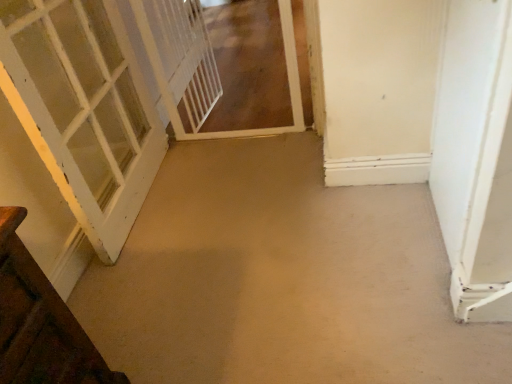
Question: Is beige carpet at center inside white painted wood door at left, which is the third door in right-to-left order?

Choices:
 (A) no
 (B) yes

Answer: (A)

Question: Is white painted wood door at left, which is the third door in right-to-left order, behind beige carpet at center?

Choices:
 (A) no
 (B) yes

Answer: (B)

Question: Is there a large distance between white painted wood door at left, which is the third door in right-to-left order, and beige carpet at center?

Choices:
 (A) yes
 (B) no

Answer: (B)

Question: Does white painted wood door at left, marked as the first door in a left-to-right arrangement, have a smaller size compared to beige carpet at center?

Choices:
 (A) yes
 (B) no

Answer: (B)

Question: Does white painted wood door at left, marked as the first door in a left-to-right arrangement, come in front of beige carpet at center?

Choices:
 (A) no
 (B) yes

Answer: (A)

Question: From the image's perspective, is white mesh screen door at center, which ranks as the 1th screen door in left-to-right order, located above or below beige carpet at center?

Choices:
 (A) above
 (B) below

Answer: (A)

Question: In terms of size, does white mesh screen door at center, which is the second screen door from right to left, appear bigger or smaller than beige carpet at center?

Choices:
 (A) small
 (B) big

Answer: (A)

Question: Which is correct: white mesh screen door at center, which is the second screen door from right to left, is inside beige carpet at center, or outside of it?

Choices:
 (A) outside
 (B) inside

Answer: (A)

Question: Does point (186, 66) appear closer or farther from the camera than point (113, 324)?

Choices:
 (A) farther
 (B) closer

Answer: (A)

Question: Is white matte door at right, the 1th door when ordered from right to left, to the left or to the right of white mesh screen door at center, which is the second screen door from right to left, in the image?

Choices:
 (A) right
 (B) left

Answer: (A)

Question: Considering the positions of point (443, 96) and point (194, 59), is point (443, 96) closer or farther from the camera than point (194, 59)?

Choices:
 (A) closer
 (B) farther

Answer: (A)

Question: Is white matte door at right, which is counted as the 3th door, starting from the left, taller or shorter than white mesh screen door at center, which ranks as the 1th screen door in left-to-right order?

Choices:
 (A) short
 (B) tall

Answer: (B)

Question: Is white matte door at right, which is counted as the 3th door, starting from the left, in front of or behind white mesh screen door at center, which is the second screen door from right to left, in the image?

Choices:
 (A) front
 (B) behind

Answer: (A)

Question: Is point pyautogui.click(x=48, y=74) positioned closer to the camera than point pyautogui.click(x=441, y=66)?

Choices:
 (A) farther
 (B) closer

Answer: (A)

Question: In the image, is white painted wood door at left, which is the third door in right-to-left order, on the left side or the right side of white matte door at right, which is counted as the 3th door, starting from the left?

Choices:
 (A) right
 (B) left

Answer: (B)